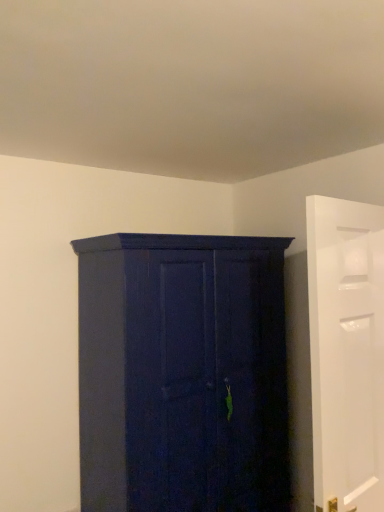
The image size is (384, 512). In order to click on white glossy door at right in this screenshot , I will do `click(346, 352)`.

Describe the element at coordinates (346, 352) in the screenshot. Image resolution: width=384 pixels, height=512 pixels. I see `white glossy door at right` at that location.

In order to click on white glossy door at right in this screenshot , I will do `click(346, 352)`.